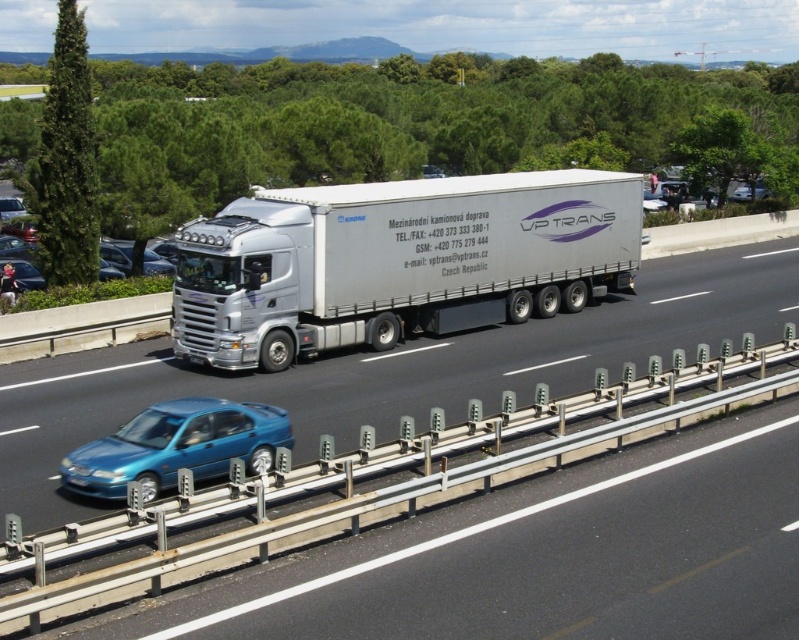
Question: Which point appears farthest from the camera in this image?

Choices:
 (A) (267, 218)
 (B) (483, 390)
 (C) (105, 486)
 (D) (110, 292)

Answer: (D)

Question: Based on their relative distances, which object is farther from the white metallic trailer truck at center?

Choices:
 (A) metallic blue sedan at left
 (B) metallic blue sedan at lower left
 (C) white metallic truck at center

Answer: (B)

Question: Observing the image, what is the correct spatial positioning of white metallic trailer truck at center in reference to metallic blue sedan at lower left?

Choices:
 (A) above
 (B) below

Answer: (A)

Question: Which of the following is the farthest from the observer?

Choices:
 (A) (26, 289)
 (B) (152, 410)
 (C) (205, 221)

Answer: (A)

Question: Can you confirm if white metallic trailer truck at center is positioned below white metallic truck at center?

Choices:
 (A) yes
 (B) no

Answer: (B)

Question: Can you confirm if white metallic trailer truck at center is bigger than metallic blue sedan at lower left?

Choices:
 (A) yes
 (B) no

Answer: (A)